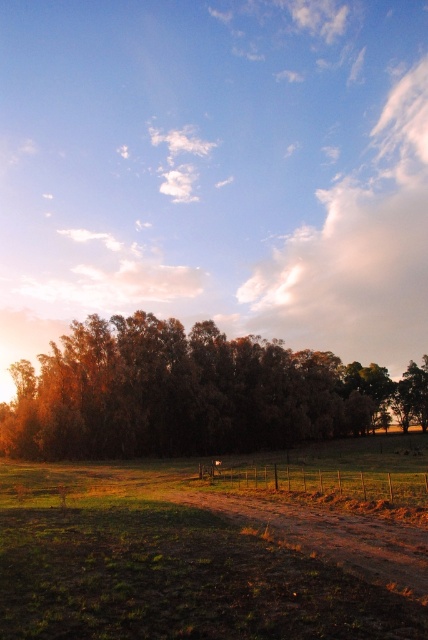
Question: In this image, where is brown textured trees at center located relative to brown dirt track at center?

Choices:
 (A) left
 (B) right

Answer: (B)

Question: Does brown textured trees at center have a smaller size compared to brown dirt track at center?

Choices:
 (A) no
 (B) yes

Answer: (A)

Question: Which point is closer to the camera taking this photo?

Choices:
 (A) (272, 525)
 (B) (264, 356)

Answer: (A)

Question: Can you confirm if brown textured trees at center is smaller than brown dirt track at center?

Choices:
 (A) no
 (B) yes

Answer: (A)

Question: Which of the following is the farthest from the observer?

Choices:
 (A) (x=371, y=577)
 (B) (x=264, y=444)

Answer: (B)